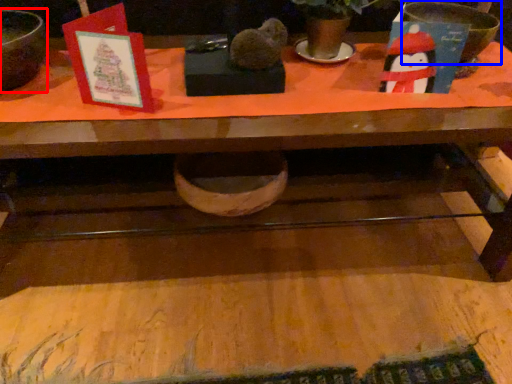
Question: Which of the following is the farthest to the observer, mixing bowl (highlighted by a red box) or basin (highlighted by a blue box)?

Choices:
 (A) mixing bowl
 (B) basin

Answer: (B)